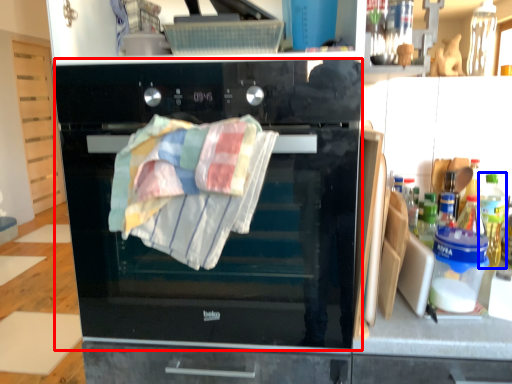
Question: Which point is further to the camera, oven (highlighted by a red box) or bottle (highlighted by a blue box)?

Choices:
 (A) oven
 (B) bottle

Answer: (B)